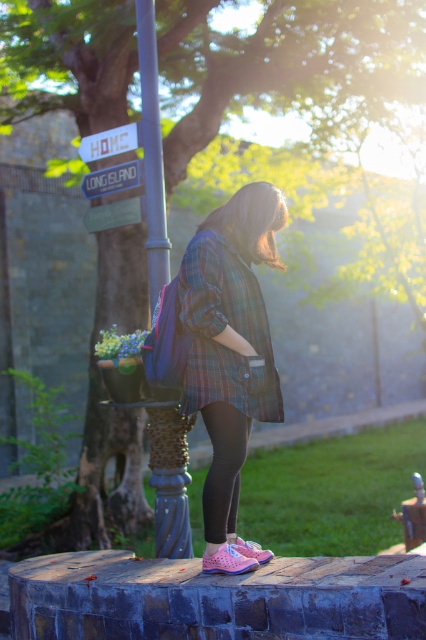
Based on the photo, you are a photographer planning to take a portrait of the woman in the scene. You notice the black leggings at lower center and the white plastic sign at upper center. Which object is closer to the camera, and why?

The black leggings at lower center are closer to the camera because they are positioned in front of the white plastic sign at upper center, which is further away.

You are standing in the scene and want to place a 3 meter long ladder between the black leggings at lower center and the white plastic sign at upper center. Is there enough space between them to fit the ladder horizontally?

The distance between the black leggings at lower center and the white plastic sign at upper center is 2.63 meters. Since the ladder is 3 meters long, it would not fit horizontally between them as the space is shorter than the ladder.

You are planning to hang a new sign on the metallic pole at upper center and the blue plastic sign at upper center. Which object would allow you to hang a larger sign without needing to adjust its current position?

The metallic pole at upper center has a larger size compared to the blue plastic sign at upper center, so it can accommodate a larger sign without needing to adjust its current position.